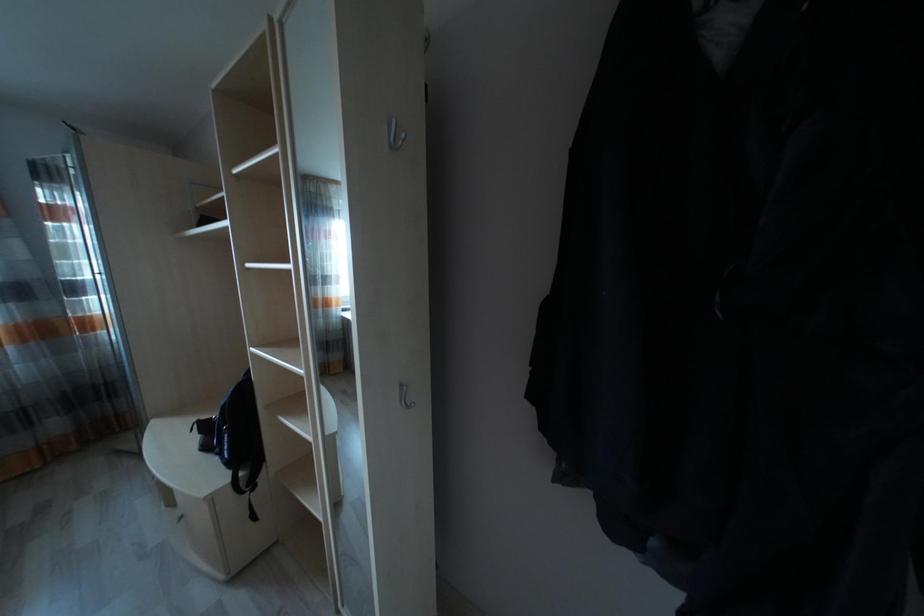
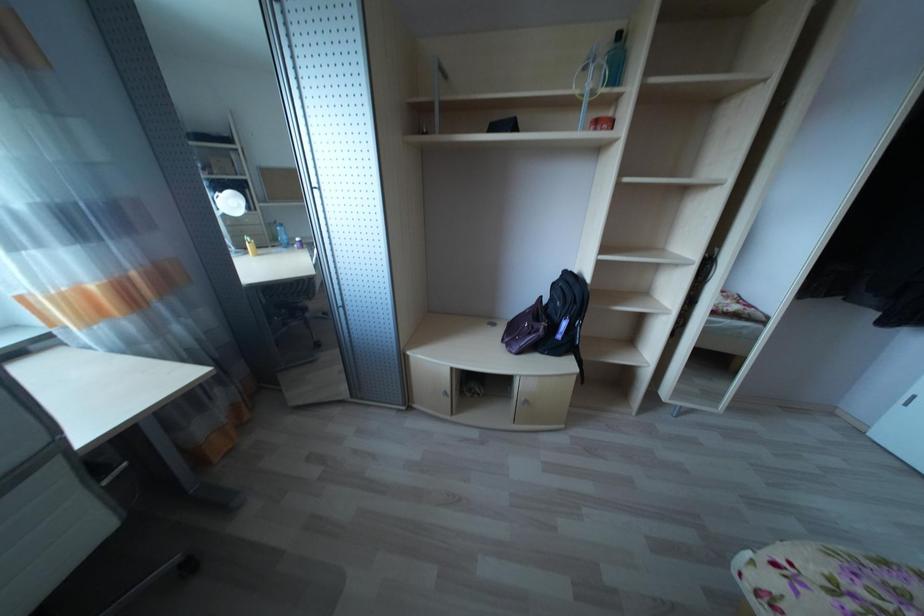
Question: The images are taken continuously from a first-person perspective. In which direction are you moving?

Choices:
 (A) Left
 (B) Right
 (C) Forward
 (D) Backward

Answer: (A)